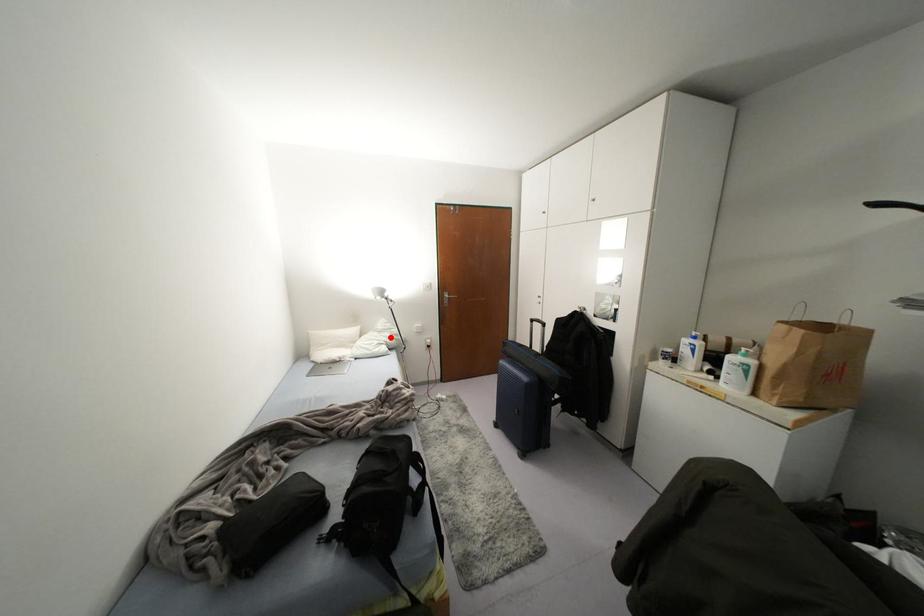
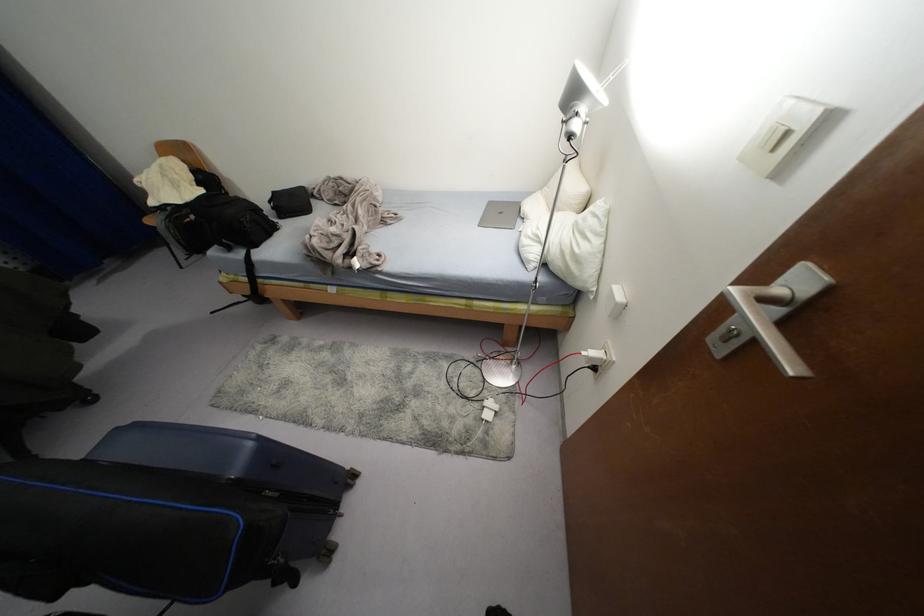
In the second image, find the point that corresponds to the highlighted location in the first image.

(561, 251)